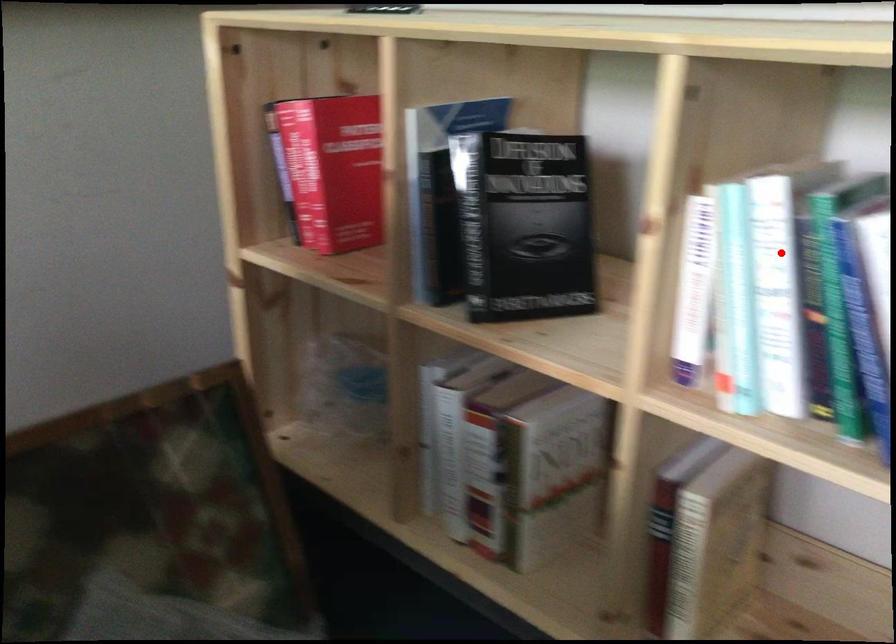
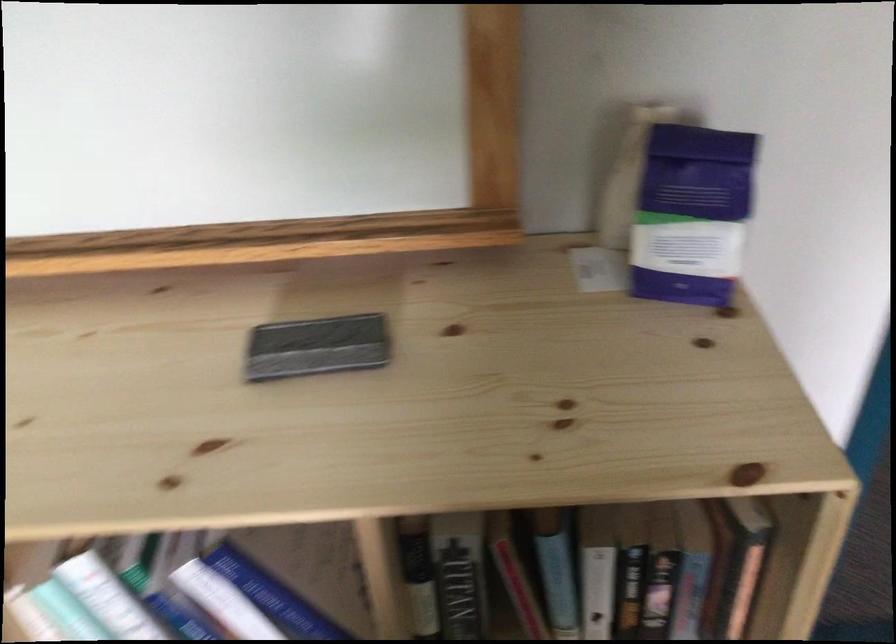
Where in the second image is the point corresponding to the highlighted location from the first image?

(166, 612)